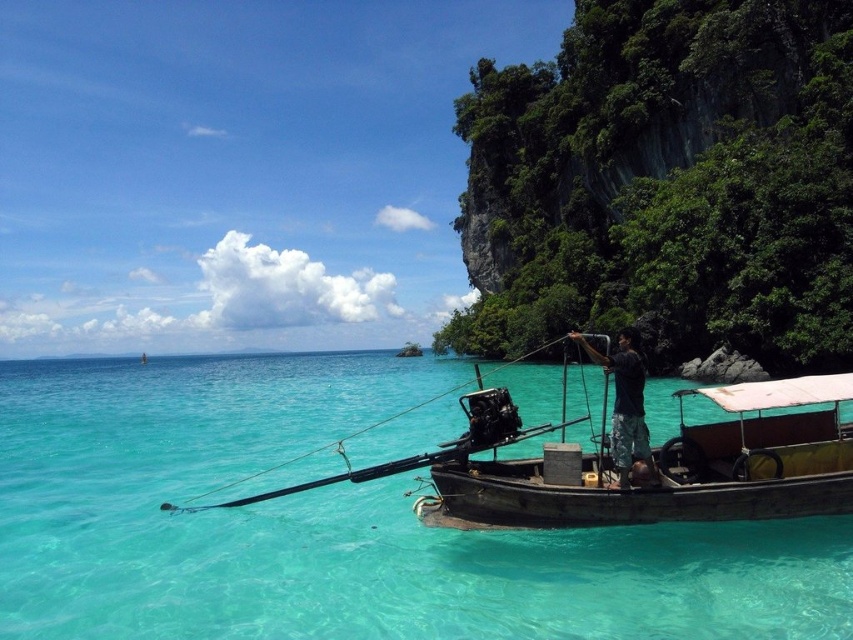
Question: Among these points, which one is farthest from the camera?

Choices:
 (A) (769, 449)
 (B) (305, 484)
 (C) (310, 502)

Answer: (C)

Question: Which point is closer to the camera taking this photo?

Choices:
 (A) (173, 467)
 (B) (630, 428)
 (C) (514, 500)
 (D) (515, 356)

Answer: (C)

Question: Does clear turquoise water at center appear on the left side of dark gray fabric shirt at center?

Choices:
 (A) no
 (B) yes

Answer: (B)

Question: Which object is closer to the camera taking this photo?

Choices:
 (A) wooden fishing pole at center
 (B) clear turquoise water at center

Answer: (B)

Question: Is clear turquoise water at center smaller than wooden boat at lower right?

Choices:
 (A) yes
 (B) no

Answer: (B)

Question: Can you confirm if wooden boat at lower right is positioned to the right of wooden fishing pole at center?

Choices:
 (A) yes
 (B) no

Answer: (A)